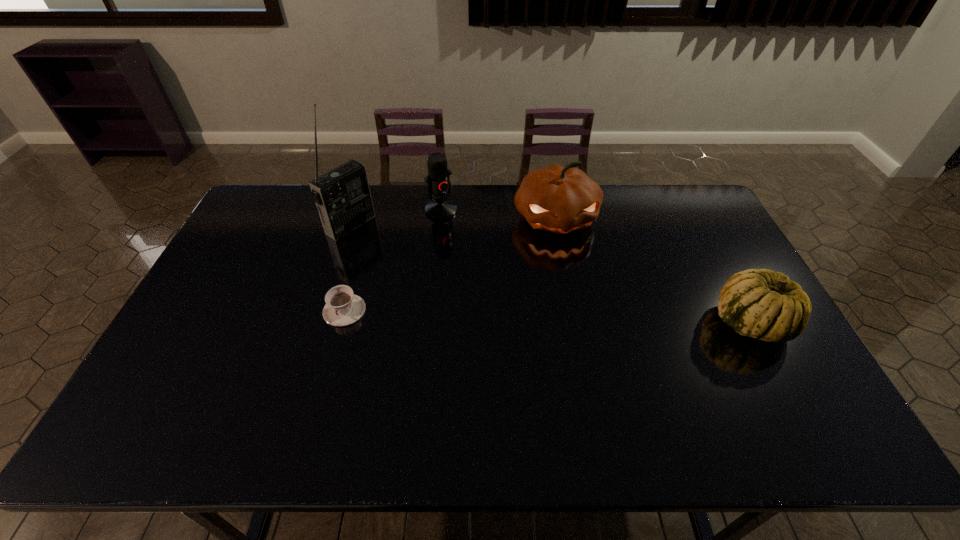
The height and width of the screenshot is (540, 960). What are the coordinates of `the shortest object` in the screenshot? It's located at (343, 307).

Locate an element on the screen. gourd is located at coordinates pyautogui.click(x=758, y=303).

I want to click on the second shortest object, so click(x=758, y=303).

Identify the location of the third object from right to left. (438, 180).

The height and width of the screenshot is (540, 960). In order to click on pumpkin in this screenshot , I will do `click(559, 199)`.

The width and height of the screenshot is (960, 540). I want to click on radio receiver, so click(342, 196).

You are a GUI agent. You are given a task and a screenshot of the screen. Output one action in this format:
    pyautogui.click(x=<x>, y=<y>)
    Task: Click on the vacant region located on the handle side of the shortest object
    
    Given the screenshot: What is the action you would take?
    pyautogui.click(x=330, y=361)

Find the location of a particular element. The image size is (960, 540). vacant space located on the back of the fourth tallest object is located at coordinates (696, 222).

The width and height of the screenshot is (960, 540). I want to click on vacant position located 0.130m on the side of the third object from left to right with the red ring, so click(x=468, y=240).

Image resolution: width=960 pixels, height=540 pixels. Identify the location of vacant space located on the side of the third object from left to right with the red ring. (503, 280).